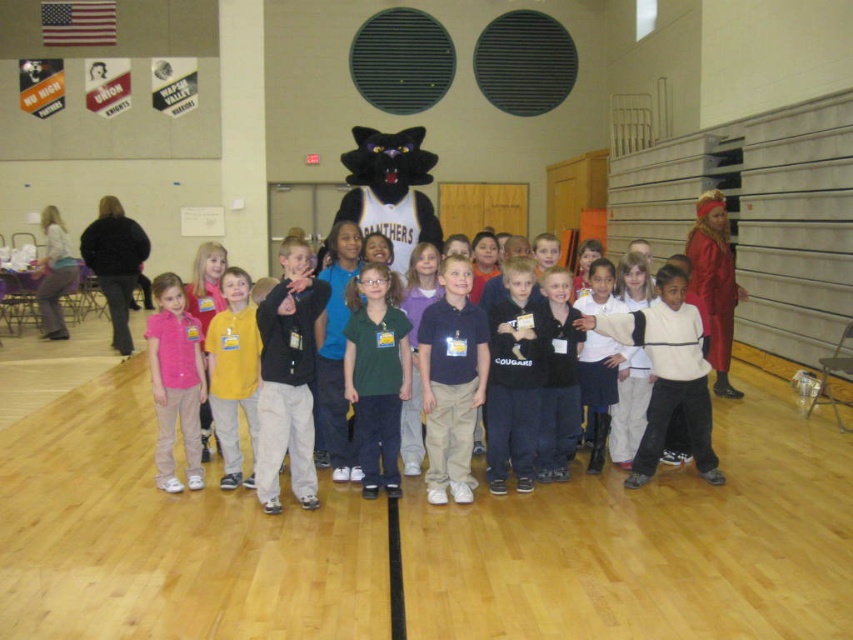
Does matte black shirt at center have a greater height compared to pink fabric at left?

No.

The image size is (853, 640). I want to click on matte black shirt at center, so click(x=695, y=404).

From the picture: Is green matte shirt at center taller than black plush mascot at center?

Yes.

Does green matte shirt at center have a smaller size compared to black plush mascot at center?

Yes.

Measure the distance between point (x=346, y=333) and camera.

4.84 meters

Where is `green matte shirt at center`? Image resolution: width=853 pixels, height=640 pixels. green matte shirt at center is located at coordinates (376, 374).

How distant is green matte shirt at center from pink fabric at left?

green matte shirt at center is 5.80 meters away from pink fabric at left.

Which is above, green matte shirt at center or pink fabric at left?

pink fabric at left

Is point (395, 420) closer to viewer compared to point (125, 339)?

Yes, it is.

Locate an element on the screen. The image size is (853, 640). green matte shirt at center is located at coordinates 376,374.